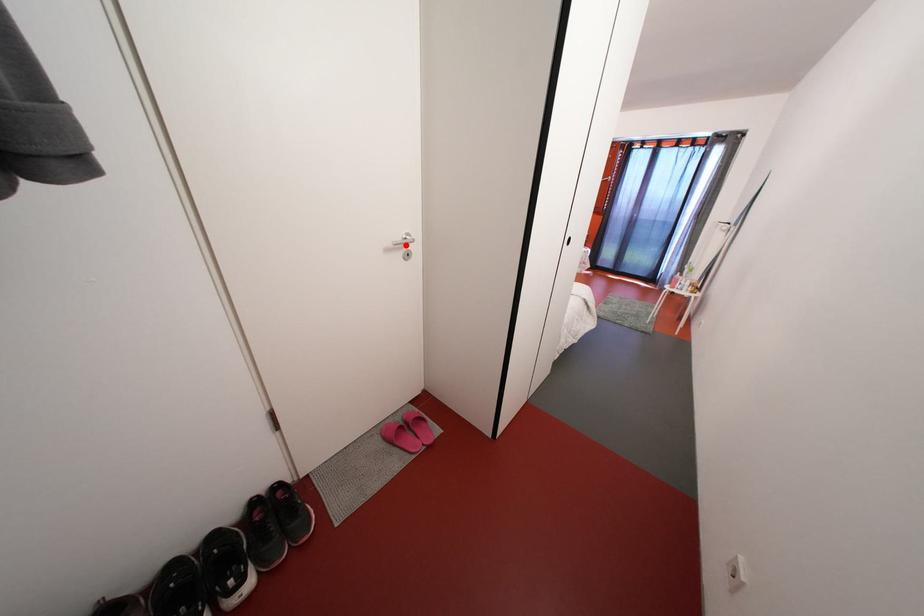
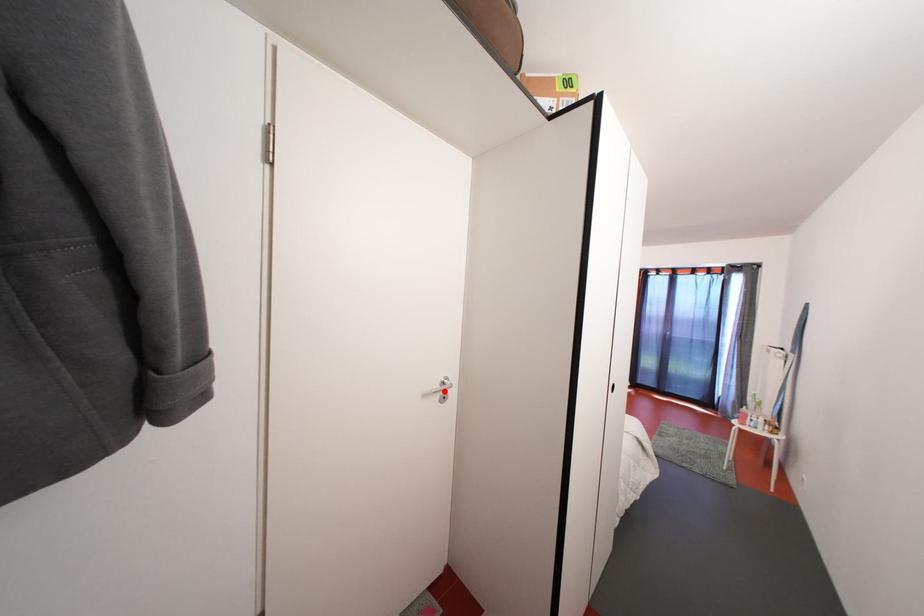
I am providing you with two images of the same scene from different viewpoints. A red point is marked on the first image and another point is marked on the second image. Are the points marked in image1 and image2 representing the same 3D position?

Yes